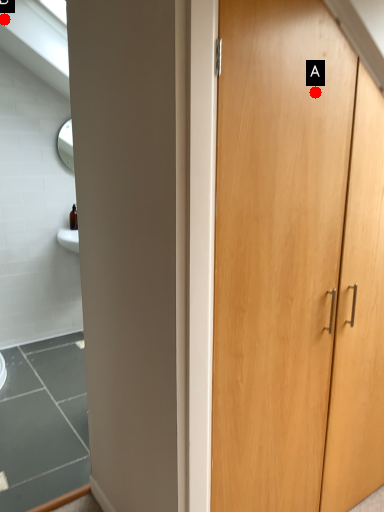
Question: Two points are circled on the image, labeled by A and B beside each circle. Which of the following is the closest to the observer?

Choices:
 (A) A is closer
 (B) B is closer

Answer: (A)